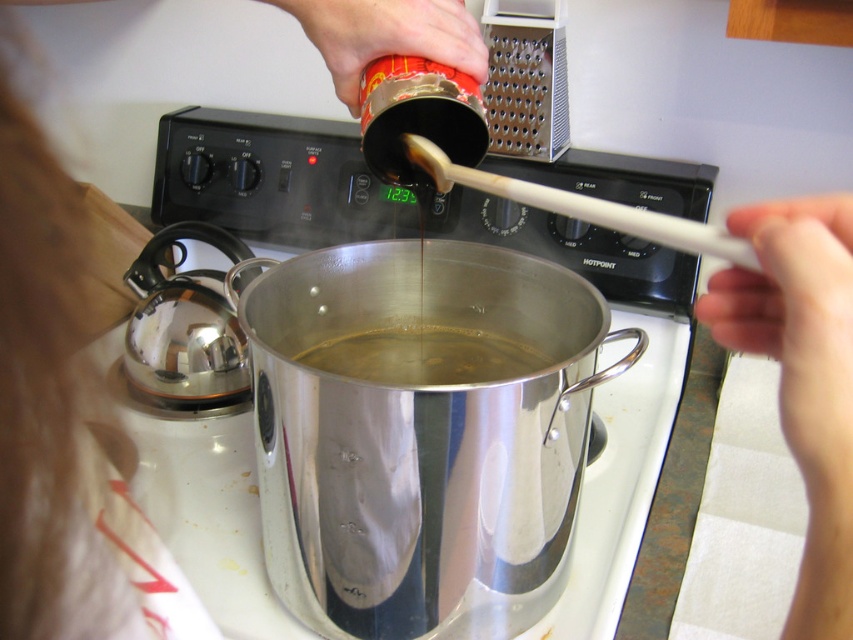
Question: Among these objects, which one is farthest from the camera?

Choices:
 (A) translucent liquid at center
 (B) wooden spoon at upper center
 (C) white plastic spoon at upper right

Answer: (B)

Question: Does wooden spoon at upper center have a lesser width compared to translucent liquid at center?

Choices:
 (A) yes
 (B) no

Answer: (A)

Question: Which point is closer to the camera taking this photo?

Choices:
 (A) (413, 20)
 (B) (477, 374)
 (C) (824, 253)

Answer: (C)

Question: Is white plastic spoon at upper right wider than wooden spoon at upper center?

Choices:
 (A) no
 (B) yes

Answer: (A)

Question: Which point appears closest to the camera in this image?

Choices:
 (A) (323, 360)
 (B) (722, 298)

Answer: (B)

Question: In this image, where is white plastic spoon at upper right located relative to wooden spoon at upper center?

Choices:
 (A) above
 (B) below

Answer: (B)